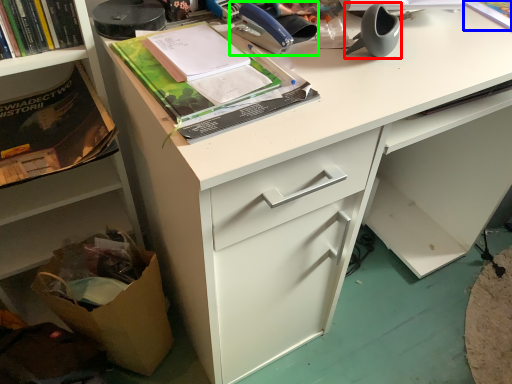
Question: Which object is positioned farthest from office supplies (highlighted by a red box)? Select from book (highlighted by a blue box) and office supplies (highlighted by a green box).

Choices:
 (A) book
 (B) office supplies

Answer: (A)